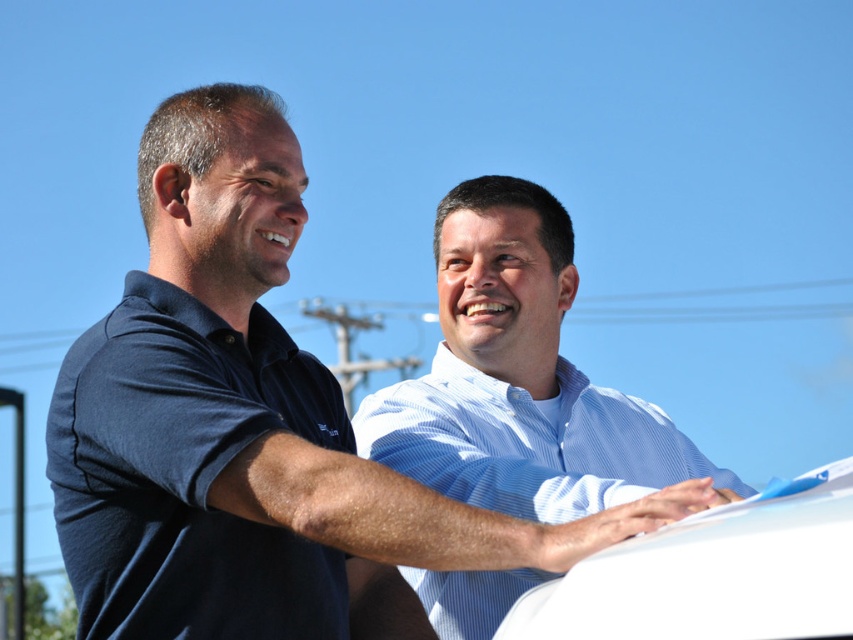
Question: Among these objects, which one is nearest to the camera?

Choices:
 (A) blue cotton shirt at upper center
 (B) white matte car at center

Answer: (B)

Question: Which point is closer to the camera?

Choices:
 (A) (321, 609)
 (B) (590, 604)

Answer: (B)

Question: Can you confirm if light blue striped shirt at center is thinner than white matte car at center?

Choices:
 (A) yes
 (B) no

Answer: (B)

Question: Considering the real-world distances, which object is farthest from the blue cotton shirt at upper center?

Choices:
 (A) white matte car at center
 (B) light blue striped shirt at center

Answer: (A)

Question: Can you confirm if blue cotton shirt at upper center is positioned to the right of white matte car at center?

Choices:
 (A) yes
 (B) no

Answer: (B)

Question: Is blue cotton shirt at upper center positioned before white matte car at center?

Choices:
 (A) yes
 (B) no

Answer: (B)